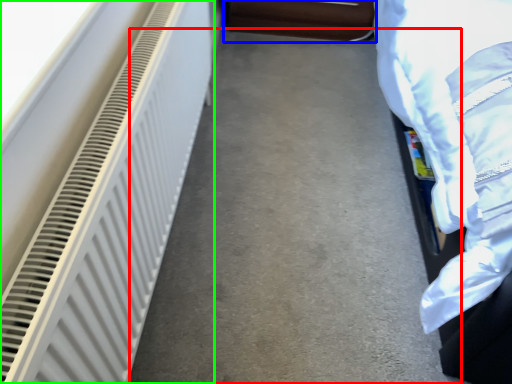
Question: Estimate the real-world distances between objects in this image. Which object is farther from concrete (highlighted by a red box), furniture (highlighted by a blue box) or radiator (highlighted by a green box)?

Choices:
 (A) furniture
 (B) radiator

Answer: (A)